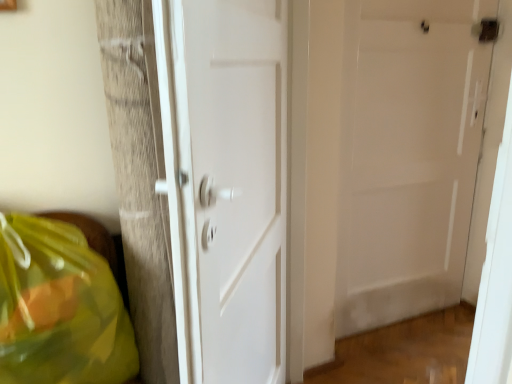
The width and height of the screenshot is (512, 384). What do you see at coordinates (226, 183) in the screenshot? I see `white glossy door at center, acting as the 2th door starting from the back` at bounding box center [226, 183].

In order to click on translucent yellow plastic bag at lower left in this screenshot , I will do `click(59, 308)`.

I want to click on white matte door at center, placed as the second door when sorted from left to right, so click(408, 155).

Where is `door that is the 1st object above the translucent yellow plastic bag at lower left (from a real-world perspective)`? The height and width of the screenshot is (384, 512). door that is the 1st object above the translucent yellow plastic bag at lower left (from a real-world perspective) is located at coordinates (226, 183).

Does white glossy door at center, the 1th door from the left, turn towards translucent yellow plastic bag at lower left?

Yes, white glossy door at center, the 1th door from the left, is turned towards translucent yellow plastic bag at lower left.

Is white glossy door at center, the 1th door viewed from the front, placed right next to translucent yellow plastic bag at lower left?

white glossy door at center, the 1th door viewed from the front, is not next to translucent yellow plastic bag at lower left, and they're not touching.

Is point (174, 78) closer or farther from the camera than point (89, 368)?

Point (174, 78).

What are the coordinates of `door above the white glossy door at center, acting as the 2th door starting from the back (from a real-world perspective)` in the screenshot? It's located at (408, 155).

Is white matte door at center, placed as the second door when sorted from front to back, positioned far away from white glossy door at center, positioned as the 2th door in right-to-left order?

No, white matte door at center, placed as the second door when sorted from front to back, is in close proximity to white glossy door at center, positioned as the 2th door in right-to-left order.

Is white matte door at center, the first door positioned from the right, further to camera compared to white glossy door at center, positioned as the 2th door in right-to-left order?

Yes, white matte door at center, the first door positioned from the right, is further from the viewer.

Considering the sizes of objects white matte door at center, the first door positioned from the right, and white glossy door at center, the 1th door from the left, in the image provided, who is wider, white matte door at center, the first door positioned from the right, or white glossy door at center, the 1th door from the left,?

white glossy door at center, the 1th door from the left, is wider.

Considering the sizes of objects translucent yellow plastic bag at lower left and white matte door at center, the first door positioned from the right, in the image provided, who is smaller, translucent yellow plastic bag at lower left or white matte door at center, the first door positioned from the right,?

With smaller size is white matte door at center, the first door positioned from the right.

Does translucent yellow plastic bag at lower left come behind white matte door at center, the first door positioned from the right?

No, translucent yellow plastic bag at lower left is in front of white matte door at center, the first door positioned from the right.

At what (x,y) coordinates should I click in order to perform the action: click on grocery bag that is under the white matte door at center, positioned as the 1th door in back-to-front order (from a real-world perspective). Please return your answer as a coordinate pair (x, y). Looking at the image, I should click on (59, 308).

In terms of width, does translucent yellow plastic bag at lower left look wider or thinner when compared to white matte door at center, positioned as the 1th door in back-to-front order?

In the image, translucent yellow plastic bag at lower left appears to be wider than white matte door at center, positioned as the 1th door in back-to-front order.

Considering the positions of objects white glossy door at center, acting as the 2th door starting from the back, and white matte door at center, the first door positioned from the right, in the image provided, who is more to the right, white glossy door at center, acting as the 2th door starting from the back, or white matte door at center, the first door positioned from the right,?

white matte door at center, the first door positioned from the right, is more to the right.

Is white glossy door at center, the 1th door viewed from the front, shorter than white matte door at center, placed as the second door when sorted from front to back?

Yes, white glossy door at center, the 1th door viewed from the front, is shorter than white matte door at center, placed as the second door when sorted from front to back.

Can you see white glossy door at center, the 1th door viewed from the front, touching white matte door at center, positioned as the 1th door in back-to-front order?

white glossy door at center, the 1th door viewed from the front, and white matte door at center, positioned as the 1th door in back-to-front order, are clearly separated.

Which is in front, white glossy door at center, positioned as the 2th door in right-to-left order, or white matte door at center, placed as the second door when sorted from left to right?

white glossy door at center, positioned as the 2th door in right-to-left order, is in front.

Does point (463, 159) come in front of point (32, 374)?

No, (463, 159) is behind (32, 374).

Is white matte door at center, placed as the second door when sorted from front to back, far from translucent yellow plastic bag at lower left?

Indeed, white matte door at center, placed as the second door when sorted from front to back, is not near translucent yellow plastic bag at lower left.

In terms of width, does white matte door at center, placed as the second door when sorted from front to back, look wider or thinner when compared to translucent yellow plastic bag at lower left?

In the image, white matte door at center, placed as the second door when sorted from front to back, appears to be more narrow than translucent yellow plastic bag at lower left.

Could you tell me if translucent yellow plastic bag at lower left is facing white glossy door at center, acting as the 2th door starting from the back?

No, translucent yellow plastic bag at lower left is not facing towards white glossy door at center, acting as the 2th door starting from the back.

In terms of width, does translucent yellow plastic bag at lower left look wider or thinner when compared to white glossy door at center, the 1th door viewed from the front?

In the image, translucent yellow plastic bag at lower left appears to be wider than white glossy door at center, the 1th door viewed from the front.

From the image's perspective, is translucent yellow plastic bag at lower left under white glossy door at center, positioned as the 2th door in right-to-left order?

Yes.

Is the position of translucent yellow plastic bag at lower left more distant than that of white glossy door at center, the 1th door viewed from the front?

Yes, it is.

The width and height of the screenshot is (512, 384). Find the location of `the 1st door to the right of the translucent yellow plastic bag at lower left, starting your count from the anchor`. the 1st door to the right of the translucent yellow plastic bag at lower left, starting your count from the anchor is located at coordinates (226, 183).

Where is `door lying behind the white glossy door at center, the 1th door from the left`? door lying behind the white glossy door at center, the 1th door from the left is located at coordinates (408, 155).

Looking at the image, which one is located further to white glossy door at center, the 1th door from the left, translucent yellow plastic bag at lower left or white matte door at center, placed as the second door when sorted from front to back?

Among the two, white matte door at center, placed as the second door when sorted from front to back, is located further to white glossy door at center, the 1th door from the left.

Which object lies further to the anchor point translucent yellow plastic bag at lower left, white glossy door at center, acting as the 2th door starting from the back, or white matte door at center, the first door positioned from the right?

white matte door at center, the first door positioned from the right, is positioned further to the anchor translucent yellow plastic bag at lower left.

Based on their spatial positions, is white glossy door at center, positioned as the 2th door in right-to-left order, or translucent yellow plastic bag at lower left closer to white matte door at center, the first door positioned from the right?

The object closer to white matte door at center, the first door positioned from the right, is white glossy door at center, positioned as the 2th door in right-to-left order.

Based on their spatial positions, is translucent yellow plastic bag at lower left or white glossy door at center, the 1th door viewed from the front, further from white matte door at center, positioned as the 1th door in back-to-front order?

The object further to white matte door at center, positioned as the 1th door in back-to-front order, is translucent yellow plastic bag at lower left.

Estimate the real-world distances between objects in this image. Which object is further from translucent yellow plastic bag at lower left, white matte door at center, placed as the second door when sorted from left to right, or white glossy door at center, the 1th door from the left?

Among the two, white matte door at center, placed as the second door when sorted from left to right, is located further to translucent yellow plastic bag at lower left.

Estimate the real-world distances between objects in this image. Which object is closer to white glossy door at center, acting as the 2th door starting from the back, white matte door at center, placed as the second door when sorted from front to back, or translucent yellow plastic bag at lower left?

Based on the image, translucent yellow plastic bag at lower left appears to be nearer to white glossy door at center, acting as the 2th door starting from the back.

The width and height of the screenshot is (512, 384). What are the coordinates of `door between translucent yellow plastic bag at lower left and white matte door at center, the first door positioned from the right` in the screenshot? It's located at (226, 183).